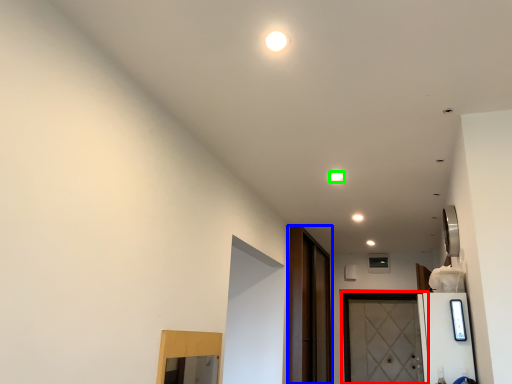
Question: Considering the real-world distances, which object is farthest from door (highlighted by a red box)? screen door (highlighted by a blue box) or light (highlighted by a green box)?

Choices:
 (A) screen door
 (B) light

Answer: (B)